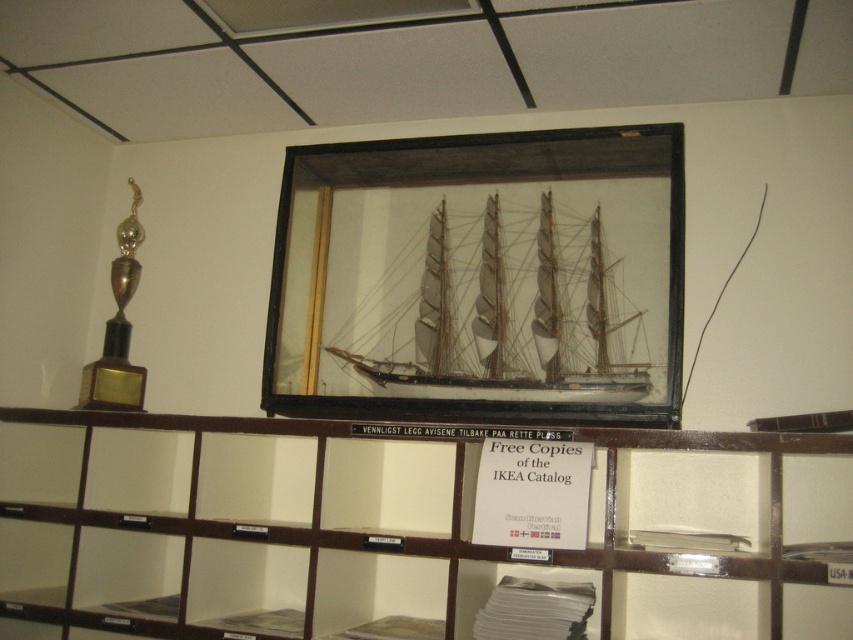
You are an interior designer assessing the display shelf. The wooden ship at center and the gold polished trophy at left are both displayed on the shelf. Which object is shorter in height?

The wooden ship at center is shorter in height compared to the gold polished trophy at left.

You are a delivery person who needs to place a new item between the wooden at center and the gold polished trophy at left. The item is 24 inches long. Will it fit in the space between them?

The distance between the wooden at center and the gold polished trophy at left is 23.51 inches. Since the item is 24 inches long, it will not fit in the space between them.